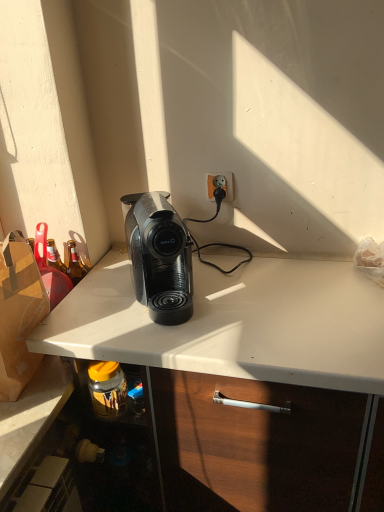
This screenshot has height=512, width=384. Identify the location of black plastic coffee machine at center. (159, 257).

Describe the element at coordinates (159, 257) in the screenshot. I see `black plastic coffee machine at center` at that location.

Measure the distance between orange matte power outlet at upper center and camera.

The distance of orange matte power outlet at upper center from camera is 4.25 feet.

What do you see at coordinates (221, 185) in the screenshot? The image size is (384, 512). I see `orange matte power outlet at upper center` at bounding box center [221, 185].

You are a GUI agent. You are given a task and a screenshot of the screen. Output one action in this format:
    pyautogui.click(x=<x>, y=<y>)
    Task: Click on the orange matte power outlet at upper center
    The width and height of the screenshot is (384, 512).
    Given the screenshot: What is the action you would take?
    pyautogui.click(x=221, y=185)

Find the location of a particular element. black plastic coffee machine at center is located at coordinates (159, 257).

Between orange matte power outlet at upper center and black plastic coffee machine at center, which one appears on the left side from the viewer's perspective?

black plastic coffee machine at center.

Is the depth of orange matte power outlet at upper center less than that of black plastic coffee machine at center?

That is False.

Considering the positions of points (226, 199) and (162, 216), is point (226, 199) farther from camera compared to point (162, 216)?

That is True.

From the image's perspective, which one is positioned lower, orange matte power outlet at upper center or black plastic coffee machine at center?

From the image's view, black plastic coffee machine at center is below.

Looking at this image, from a real-world perspective, does orange matte power outlet at upper center sit lower than black plastic coffee machine at center?

No, from a real-world perspective, orange matte power outlet at upper center is not under black plastic coffee machine at center.

Considering the relative sizes of orange matte power outlet at upper center and black plastic coffee machine at center in the image provided, is orange matte power outlet at upper center wider than black plastic coffee machine at center?

Incorrect, the width of orange matte power outlet at upper center does not surpass that of black plastic coffee machine at center.

Which of these two, orange matte power outlet at upper center or black plastic coffee machine at center, stands taller?

black plastic coffee machine at center is taller.

Can you confirm if orange matte power outlet at upper center is smaller than black plastic coffee machine at center?

Yes.

Is orange matte power outlet at upper center not inside black plastic coffee machine at center?

Yes.

Is orange matte power outlet at upper center far from black plastic coffee machine at center?

No, orange matte power outlet at upper center is not far away from black plastic coffee machine at center.

Is orange matte power outlet at upper center looking in the opposite direction of black plastic coffee machine at center?

That's not correct — orange matte power outlet at upper center is not looking away from black plastic coffee machine at center.

Can you tell me how much orange matte power outlet at upper center and black plastic coffee machine at center differ in facing direction?

They differ by 24.9 degrees in their facing directions.

How far apart are orange matte power outlet at upper center and black plastic coffee machine at center?

orange matte power outlet at upper center and black plastic coffee machine at center are 12.81 inches apart.

The image size is (384, 512). Identify the location of power outlet above the black plastic coffee machine at center (from the image's perspective). (221, 185).

Considering the positions of objects black plastic coffee machine at center and orange matte power outlet at upper center in the image provided, who is more to the right, black plastic coffee machine at center or orange matte power outlet at upper center?

orange matte power outlet at upper center.

Considering the positions of objects black plastic coffee machine at center and orange matte power outlet at upper center in the image provided, who is in front, black plastic coffee machine at center or orange matte power outlet at upper center?

black plastic coffee machine at center is closer to the camera.

Is point (151, 245) in front of point (216, 179)?

Yes, point (151, 245) is closer to viewer.

From the image's perspective, which is below, black plastic coffee machine at center or orange matte power outlet at upper center?

black plastic coffee machine at center appears lower in the image.

From a real-world perspective, is black plastic coffee machine at center below orange matte power outlet at upper center?

Yes, from a real-world perspective, black plastic coffee machine at center is below orange matte power outlet at upper center.

Which of these two, black plastic coffee machine at center or orange matte power outlet at upper center, is wider?

With larger width is black plastic coffee machine at center.

Looking at this image, from their relative heights in the image, would you say black plastic coffee machine at center is taller or shorter than orange matte power outlet at upper center?

Clearly, black plastic coffee machine at center is taller compared to orange matte power outlet at upper center.

Who is bigger, black plastic coffee machine at center or orange matte power outlet at upper center?

black plastic coffee machine at center is bigger.

Is black plastic coffee machine at center spatially inside orange matte power outlet at upper center, or outside of it?

black plastic coffee machine at center is not enclosed by orange matte power outlet at upper center.

In the scene shown: Are black plastic coffee machine at center and orange matte power outlet at upper center far apart?

No, there isn't a large distance between black plastic coffee machine at center and orange matte power outlet at upper center.

Is black plastic coffee machine at center positioned with its back to orange matte power outlet at upper center?

No, orange matte power outlet at upper center is not at the back of black plastic coffee machine at center.

Looking at this image, what's the angular difference between black plastic coffee machine at center and orange matte power outlet at upper center's facing directions?

24.9 degrees separate the facing orientations of black plastic coffee machine at center and orange matte power outlet at upper center.

Identify the location of home appliance below the orange matte power outlet at upper center (from a real-world perspective). (159, 257).

What are the coordinates of `power outlet on the right of black plastic coffee machine at center` in the screenshot? It's located at (221, 185).

This screenshot has width=384, height=512. In order to click on home appliance below the orange matte power outlet at upper center (from the image's perspective) in this screenshot , I will do `click(159, 257)`.